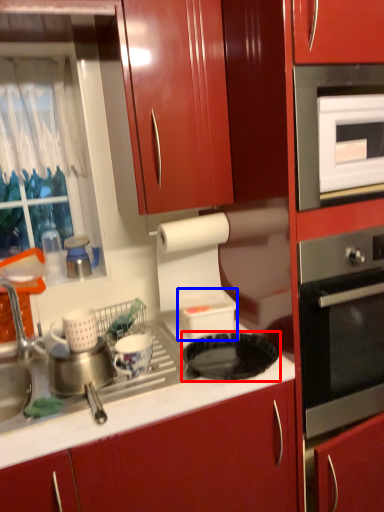
Question: Which object appears closest to the camera in this image, gas stove (highlighted by a red box) or appliance (highlighted by a blue box)?

Choices:
 (A) gas stove
 (B) appliance

Answer: (A)